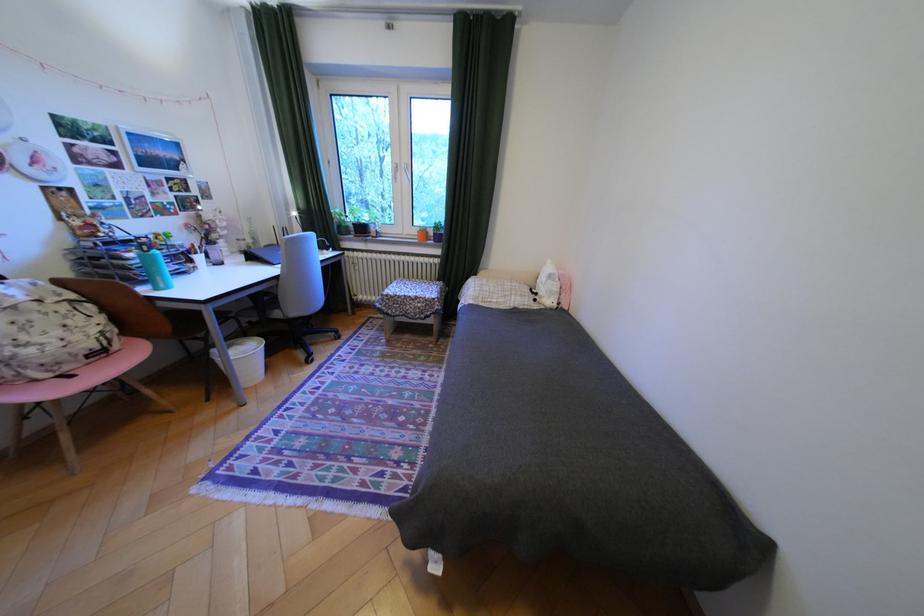
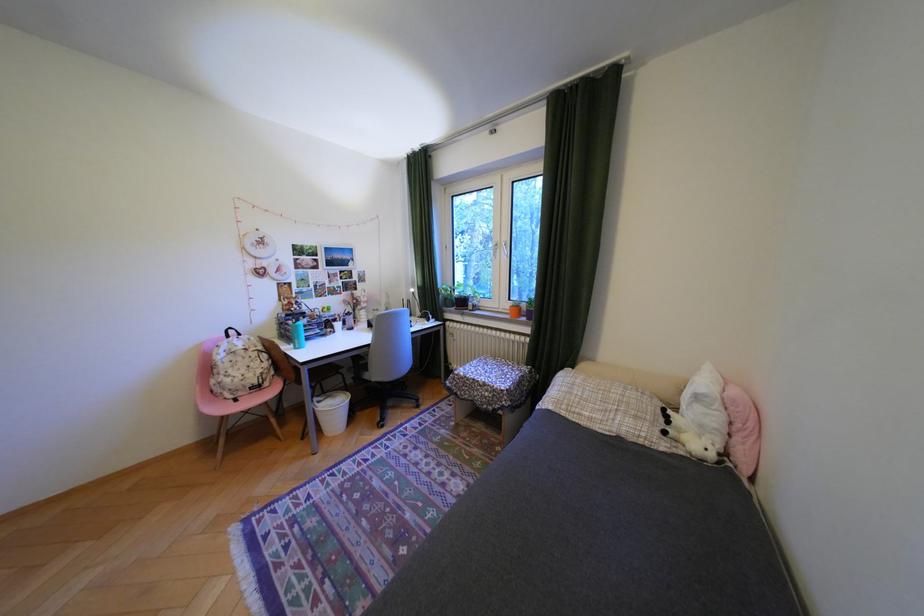
Locate, in the second image, the point that corresponds to the point at 546,300 in the first image.

(676, 432)